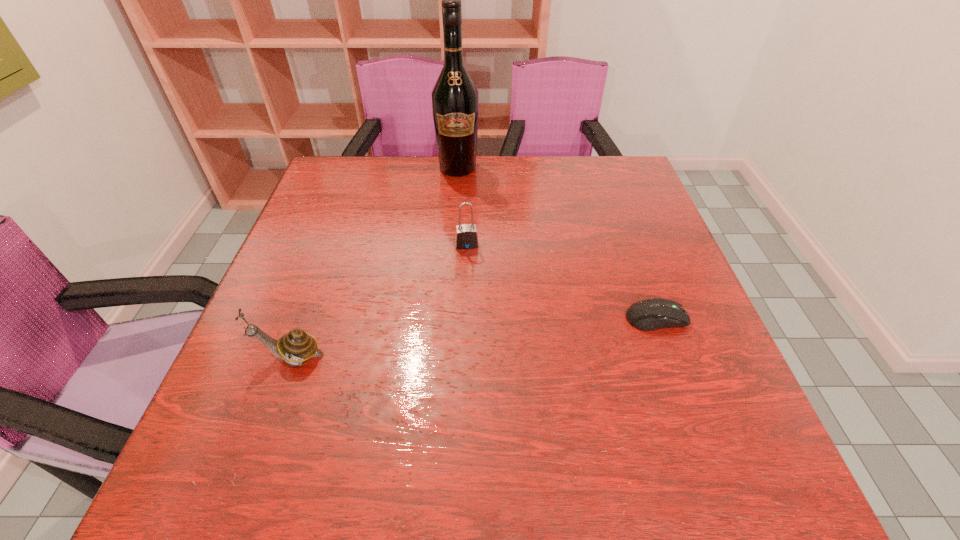
Locate an element on the screen. The width and height of the screenshot is (960, 540). vacant space positioned 0.100m on the shackle of the padlock is located at coordinates (471, 279).

This screenshot has width=960, height=540. I want to click on vacant position located 0.140m on the shackle of the padlock, so click(x=473, y=292).

This screenshot has width=960, height=540. I want to click on free space located on the shackle of the padlock, so click(x=473, y=295).

This screenshot has height=540, width=960. Identify the location of object that is at the far edge. (455, 106).

The image size is (960, 540). What are the coordinates of `object that is at the left edge` in the screenshot? It's located at pos(297,346).

This screenshot has width=960, height=540. I want to click on object located at the right edge, so [650, 314].

The width and height of the screenshot is (960, 540). Find the location of `free space at the far edge`. free space at the far edge is located at coordinates (506, 191).

The width and height of the screenshot is (960, 540). Identify the location of free space at the near edge of the desktop. (536, 394).

You are a GUI agent. You are given a task and a screenshot of the screen. Output one action in this format:
    pyautogui.click(x=<x>, y=<y>)
    Task: Click on the vacant space at the left edge of the desktop
    This screenshot has height=540, width=960.
    Given the screenshot: What is the action you would take?
    (x=306, y=222)

This screenshot has height=540, width=960. In the image, there is a desktop. What are the coordinates of `vacant region at the right edge` in the screenshot? It's located at (610, 251).